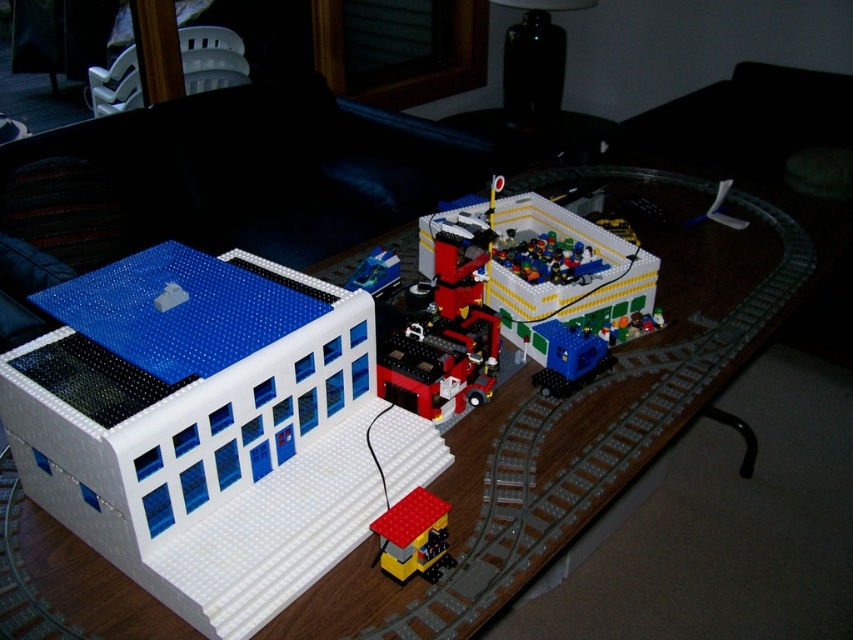
Between wooden table at center and shiny blue plastic car at center, which one has more height?

wooden table at center is taller.

Is wooden table at center above shiny blue plastic car at center?

No.

Is point (650, 177) positioned in front of point (381, 266)?

No, (650, 177) is behind (381, 266).

I want to click on wooden table at center, so click(587, 442).

Which is more to the right, brick red plastic train at lower center or shiny blue plastic car at center?

brick red plastic train at lower center is more to the right.

Is brick red plastic train at lower center further to the viewer compared to shiny blue plastic car at center?

No, brick red plastic train at lower center is in front of shiny blue plastic car at center.

Is point (422, 572) closer to viewer compared to point (380, 266)?

Yes, it is.

The height and width of the screenshot is (640, 853). I want to click on brick red plastic train at lower center, so click(413, 536).

Is point (395, 497) more distant than point (397, 285)?

No, it is not.

Between white matte building at left and shiny blue plastic car at center, which one is positioned higher?

Positioned higher is shiny blue plastic car at center.

I want to click on white matte building at left, so click(210, 428).